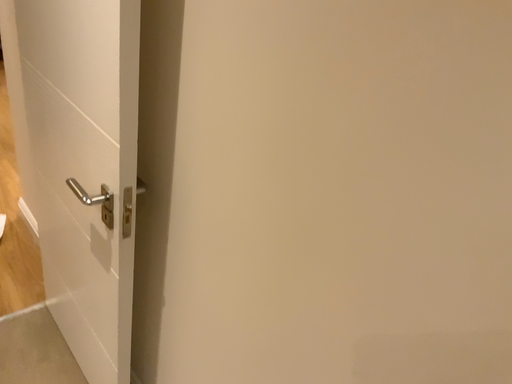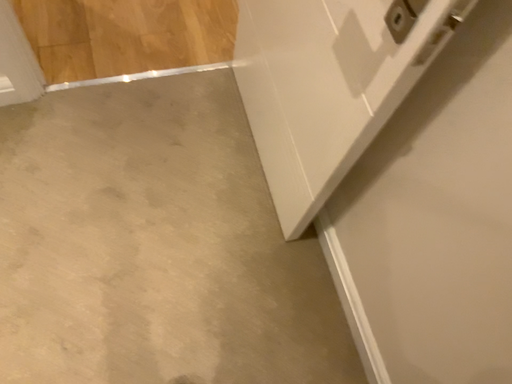
Question: Which way did the camera rotate in the video?

Choices:
 (A) rotated right
 (B) rotated left

Answer: (B)